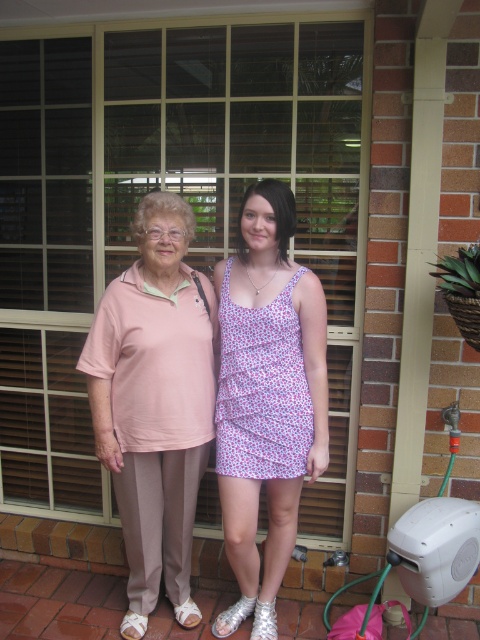
You are a photographer trying to capture a portrait of both individuals standing side by side. You notice two points marked on your camera screen at coordinates point (196, 355) and point (239, 522). Which point should you use as the focus point to ensure both subjects are in focus if you want to prioritize the person who is closer to the camera?

Point (239, 522) should be used as the focus point because it is in front of point (196, 355), meaning the person closer to the camera is at that point. Focusing on the closer subject ensures both will be in focus due to the depth of field.

You are a photographer trying to capture a portrait of the two people in front of the brick wall. The pink fabric shirt at left is important to highlight. Based on its position at point 0.631, 0.323, where should you position your camera to ensure the shirt is centered in the frame?

The pink fabric shirt at left is located at point (155,403), so positioning the camera to center on those coordinates will ensure the shirt is centered in the frame.

You are a fashion designer observing two outfits in the image. The first is a matte pink blouse at left and the second is a pink floral fabric dress at center. Which of these two outfits has a greater width?

The matte pink blouse at left has a greater width than the pink floral fabric dress at center according to the description.